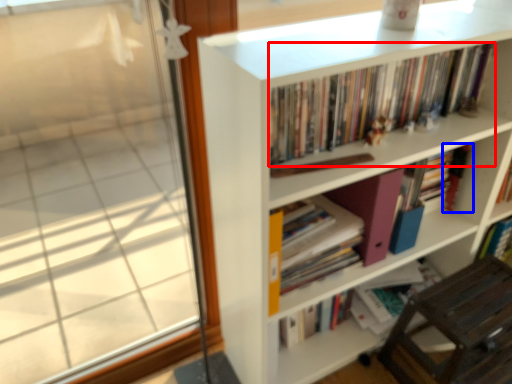
Question: Which object is closer to the camera taking this photo, book (highlighted by a red box) or book (highlighted by a blue box)?

Choices:
 (A) book
 (B) book

Answer: (A)